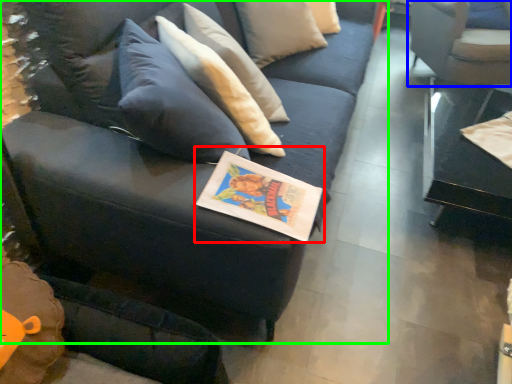
Question: Estimate the real-world distances between objects in this image. Which object is farther from book (highlighted by a red box), chair (highlighted by a blue box) or studio couch (highlighted by a green box)?

Choices:
 (A) chair
 (B) studio couch

Answer: (A)